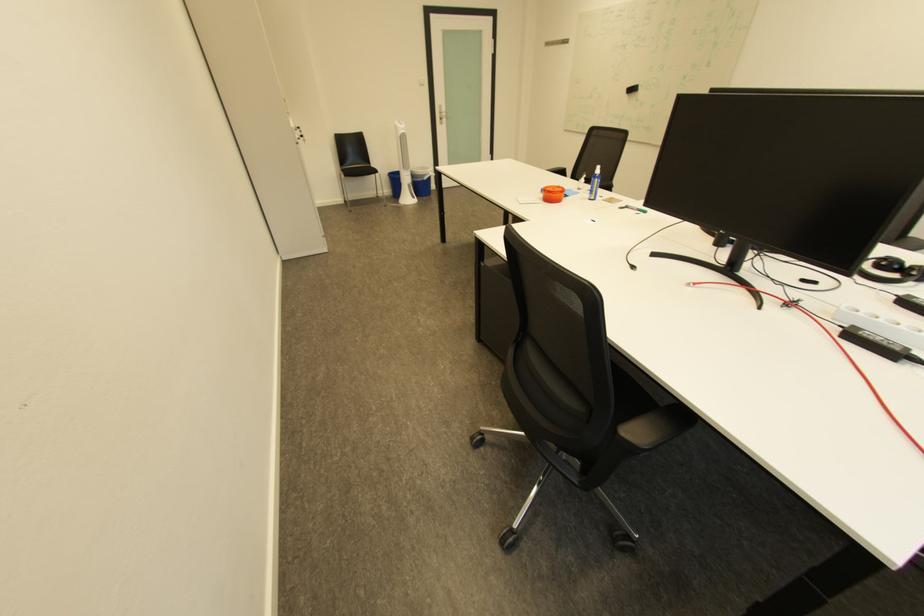
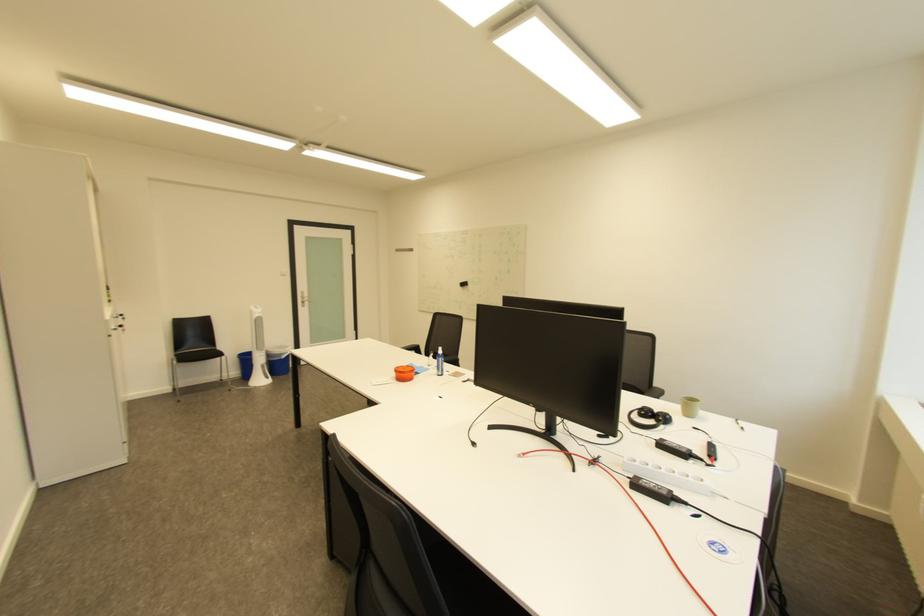
The point at (409, 180) is marked in the first image. Where is the corresponding point in the second image?

(261, 360)